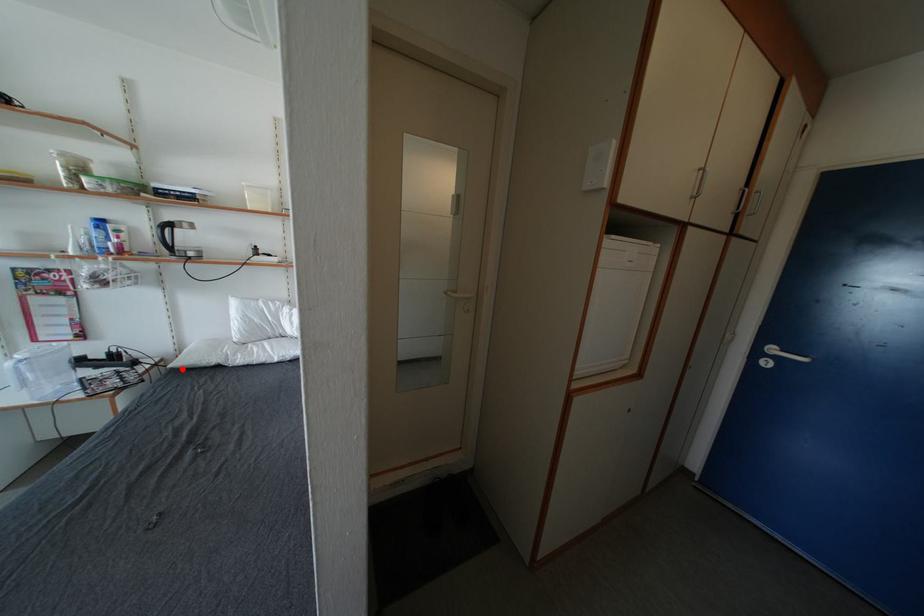
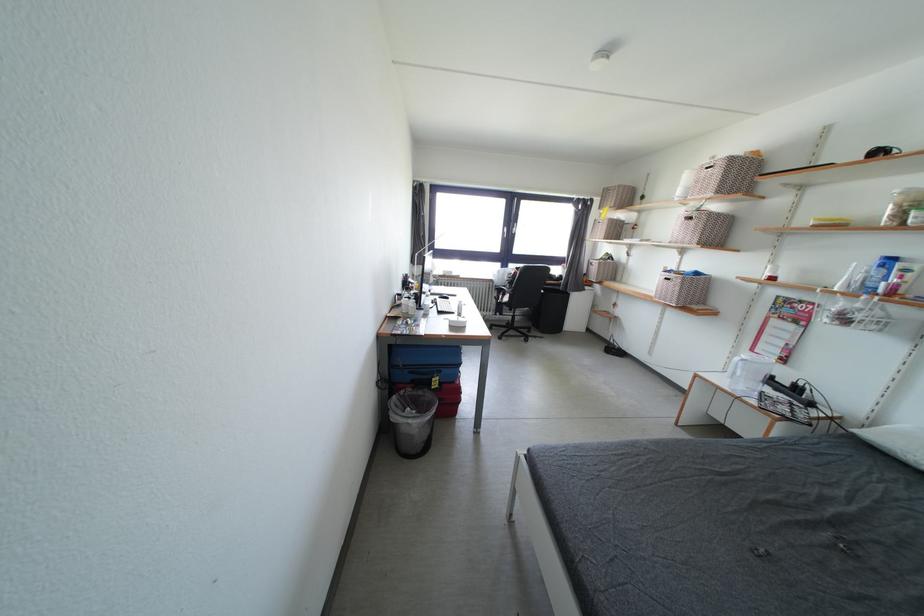
Locate, in the second image, the point that corresponds to the highlighted location in the first image.

(869, 438)